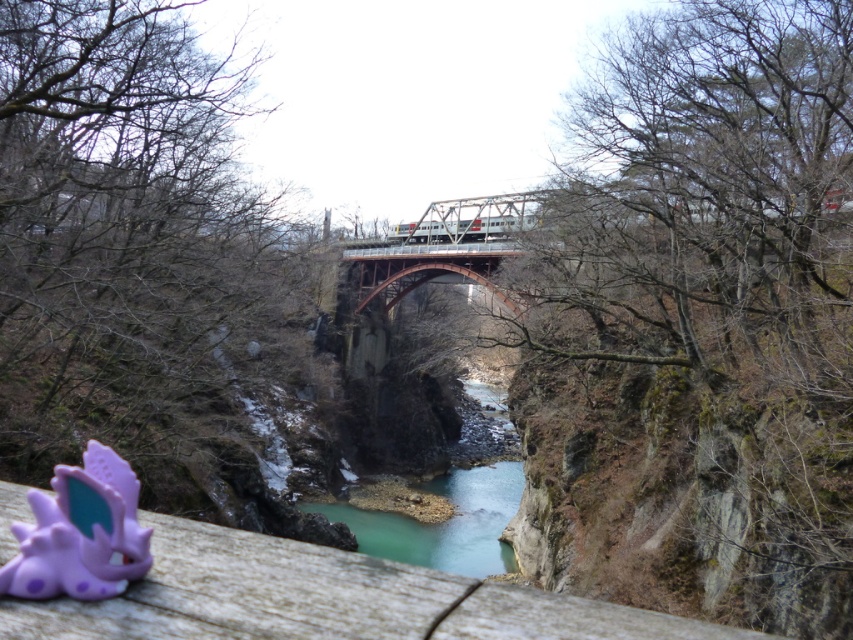
You are standing at the edge of the canyon and want to take a photo of the point located at coordinate point (97, 588). The camera you have can only focus on objects within 8 feet. Will the point be in focus?

The distance of point (97, 588) from camera is 8.12 feet, which is slightly beyond the camera focus range of 8 feet. Therefore, the point will not be in focus.

You are a hiker who wants to place a small item on the wooden ledge at lower left without it falling off. Considering the purple matte toy at lower left is already there, where should you place your item to ensure it stays?

The wooden ledge at lower left is located above the purple matte toy at lower left, so placing your item on the wooden ledge at lower left itself would keep it from falling since it is elevated above the toy.